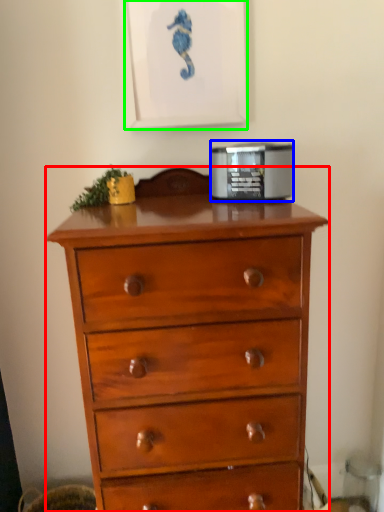
Question: Based on their relative distances, which object is farther from chest of drawers (highlighted by a red box)? Choose from appliance (highlighted by a blue box) and picture frame (highlighted by a green box).

Choices:
 (A) appliance
 (B) picture frame

Answer: (B)